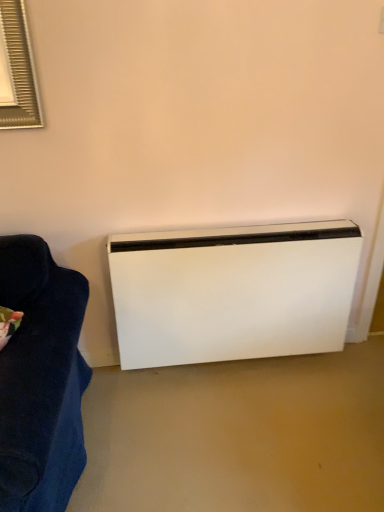
Image resolution: width=384 pixels, height=512 pixels. Identify the location of free area below white matte heater at lower right (from a real-world perspective). (223, 367).